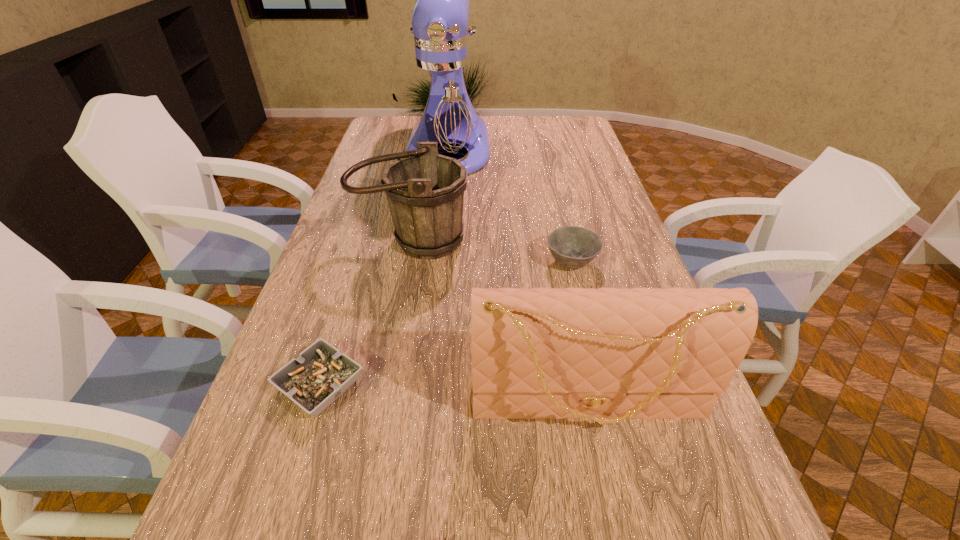
In the image, there is a desktop. Identify the location of vacant space at the right edge. This screenshot has width=960, height=540. (588, 167).

Find the location of a particular element. The height and width of the screenshot is (540, 960). vacant region between the handbag and the shortest object is located at coordinates (453, 394).

Image resolution: width=960 pixels, height=540 pixels. What are the coordinates of `free space between the tallest object and the handbag` in the screenshot? It's located at (517, 275).

Find the location of a particular element. vacant point located between the ashtray and the mixer is located at coordinates (384, 266).

Where is `vacant area between the ashtray and the handbag`? This screenshot has width=960, height=540. vacant area between the ashtray and the handbag is located at coordinates (453, 394).

Find the location of a particular element. The width and height of the screenshot is (960, 540). free space between the handbag and the shortest object is located at coordinates (453, 394).

What are the coordinates of `object that is the third closest one to the handbag` in the screenshot? It's located at (425, 190).

Choose which object is the third nearest neighbor to the bowl. Please provide its 2D coordinates. Your answer should be formatted as a tuple, i.e. [(x, y)], where the tuple contains the x and y coordinates of a point satisfying the conditions above.

[(442, 98)]

Find the location of a particular element. free point that satisfies the following two spatial constraints: 1. at the mixing area of the mixer; 2. on the right side of the bowl is located at coordinates (435, 262).